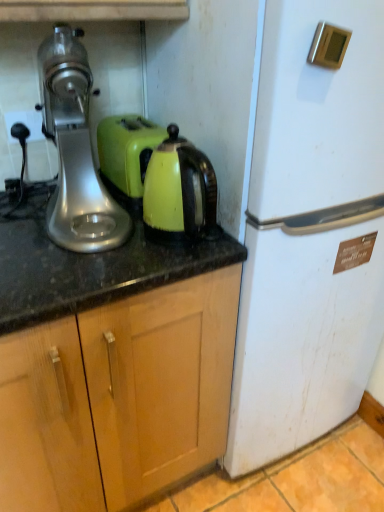
Question: From a real-world perspective, is matte green kettle at center above or below silver metallic plug at left?

Choices:
 (A) above
 (B) below

Answer: (B)

Question: Considering their positions, is matte green kettle at center located in front of or behind silver metallic plug at left?

Choices:
 (A) front
 (B) behind

Answer: (A)

Question: Which of these objects is positioned farthest from the white matte refrigerator at right?

Choices:
 (A) silver metallic plug at left
 (B) wooden cabinet at center
 (C) silver metallic stand mixer at left
 (D) matte green kettle at center

Answer: (A)

Question: Based on their relative distances, which object is nearer to the matte green kettle at center?

Choices:
 (A) silver metallic plug at left
 (B) white matte refrigerator at right
 (C) wooden cabinet at center
 (D) silver metallic stand mixer at left

Answer: (D)